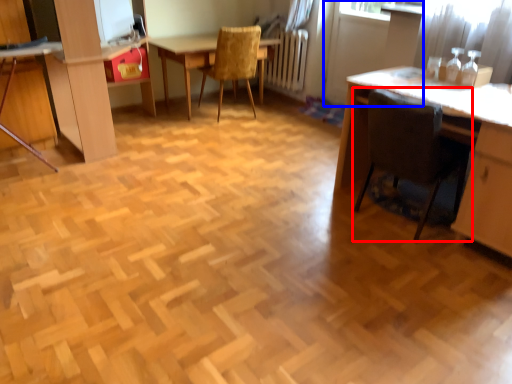
Question: Which of the following is the closest to the observer, chair (highlighted by a red box) or screen door (highlighted by a blue box)?

Choices:
 (A) chair
 (B) screen door

Answer: (A)